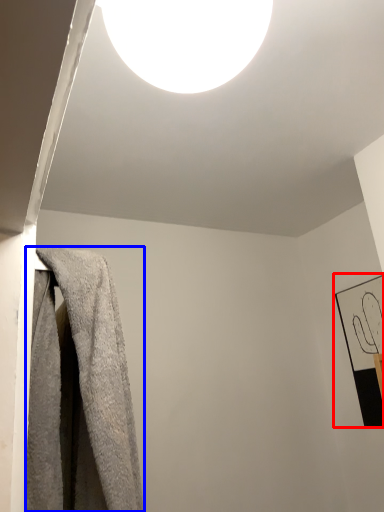
Question: Which point is further to the camera, picture frame (highlighted by a red box) or towel (highlighted by a blue box)?

Choices:
 (A) picture frame
 (B) towel

Answer: (A)